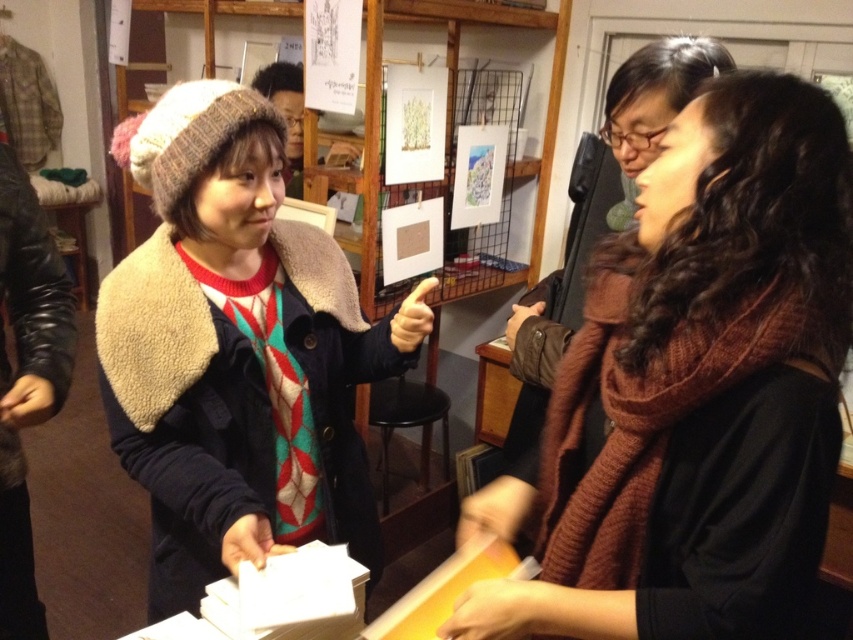
Can you confirm if brown knitted scarf at center is smaller than knitted woolen hat at upper left?

Yes.

The height and width of the screenshot is (640, 853). What do you see at coordinates (692, 390) in the screenshot?
I see `brown knitted scarf at center` at bounding box center [692, 390].

At what (x,y) coordinates should I click in order to perform the action: click on brown knitted scarf at center. Please return your answer as a coordinate pair (x, y). Looking at the image, I should click on (692, 390).

Locate an element on the screen. brown knitted scarf at center is located at coordinates (692, 390).

Is knitted woolen hat at upper left shorter than wooden table at center?

In fact, knitted woolen hat at upper left may be taller than wooden table at center.

Can you confirm if knitted woolen hat at upper left is smaller than wooden table at center?

No.

The image size is (853, 640). I want to click on knitted woolen hat at upper left, so click(x=238, y=353).

Locate an element on the screen. knitted woolen hat at upper left is located at coordinates (238, 353).

Does brown knitted scarf at center appear over wooden table at center?

Yes, brown knitted scarf at center is above wooden table at center.

Which is more to the left, brown knitted scarf at center or wooden table at center?

wooden table at center is more to the left.

Is point (833, 259) positioned before point (515, 392)?

Yes.

Where is `brown knitted scarf at center`? This screenshot has width=853, height=640. brown knitted scarf at center is located at coordinates [692, 390].